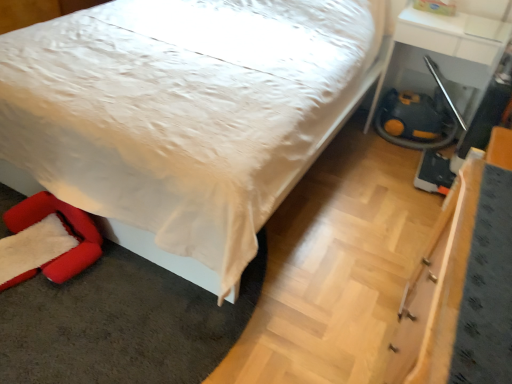
Question: Is velvet red swivel chair at lower left outside of white satin bed at center?

Choices:
 (A) yes
 (B) no

Answer: (B)

Question: Is velvet red swivel chair at lower left next to white satin bed at center?

Choices:
 (A) yes
 (B) no

Answer: (B)

Question: From a real-world perspective, is velvet red swivel chair at lower left physically above white satin bed at center?

Choices:
 (A) yes
 (B) no

Answer: (B)

Question: From the image's perspective, does velvet red swivel chair at lower left appear higher than white satin bed at center?

Choices:
 (A) yes
 (B) no

Answer: (B)

Question: Is white satin bed at center a part of velvet red swivel chair at lower left?

Choices:
 (A) no
 (B) yes

Answer: (A)

Question: From a real-world perspective, is white glossy table at lower right physically located above or below velvet red swivel chair at lower left?

Choices:
 (A) below
 (B) above

Answer: (B)

Question: In terms of height, does white glossy table at lower right look taller or shorter compared to velvet red swivel chair at lower left?

Choices:
 (A) short
 (B) tall

Answer: (B)

Question: From the image's perspective, is white glossy table at lower right positioned above or below velvet red swivel chair at lower left?

Choices:
 (A) below
 (B) above

Answer: (B)

Question: Would you say white glossy table at lower right is to the left or to the right of velvet red swivel chair at lower left in the picture?

Choices:
 (A) right
 (B) left

Answer: (A)

Question: In the image, is white satin bed at center on the left side or the right side of velvet red swivel chair at lower left?

Choices:
 (A) left
 (B) right

Answer: (B)

Question: Based on their sizes in the image, would you say white satin bed at center is bigger or smaller than velvet red swivel chair at lower left?

Choices:
 (A) big
 (B) small

Answer: (A)

Question: From a real-world perspective, relative to velvet red swivel chair at lower left, is white satin bed at center vertically above or below?

Choices:
 (A) above
 (B) below

Answer: (A)

Question: From the image's perspective, is white satin bed at center positioned above or below velvet red swivel chair at lower left?

Choices:
 (A) above
 (B) below

Answer: (A)

Question: Is point (402, 13) closer or farther from the camera than point (156, 251)?

Choices:
 (A) farther
 (B) closer

Answer: (A)

Question: Considering their positions, is white glossy table at lower right located in front of or behind white satin bed at center?

Choices:
 (A) behind
 (B) front

Answer: (A)